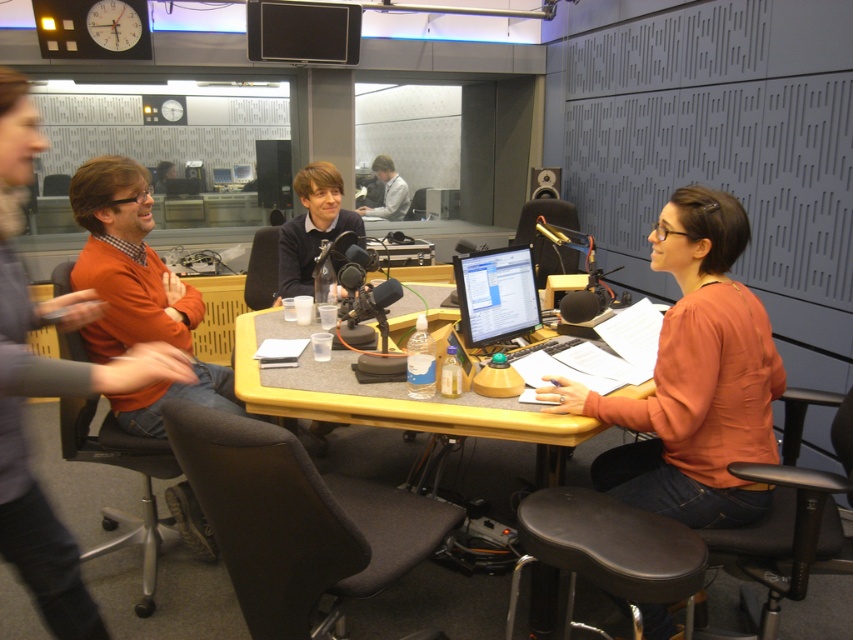
You are a sound engineer in the studio and need to adjust the microphone stand that is positioned near the yellow matte table at center. To avoid blocking the view of the orange fabric shirt at center, should you move the microphone stand closer to or farther from the table?

The orange fabric shirt at center is located above the yellow matte table at center, so moving the microphone stand closer to the table would place it directly underneath the shirt, potentially blocking its view. To avoid obstruction, move the microphone stand farther from the table.

You are a sound engineer in the radio studio and need to place a microphone stand at the exact center of the room. The black leather stool at lower center is at coordinates point 0.863, 0.714. Is the stool positioned to the left or right of the room center?

The black leather stool at lower center is located at point (608, 552). Since the coordinates are based on a scale from 0 to 1, where (426, 320) is the center, the stool is to the right and slightly below the room center because its x coordinate 0.863 is greater than 0.5 and y coordinate 0.714 is also greater than 0.5 but closer to the bottom half.

You are a sound technician in the studio and need to place a microphone stand that requires 1 meter of space. Given the orange fabric shirt at center and the yellow matte table at center, which object has a smaller width and can you fit the microphone stand between them?

The orange fabric shirt at center has a smaller width than the yellow matte table at center. Since the orange fabric shirt at center is narrower, the microphone stand requiring 1 meter of space may fit between them if the available space between the shirt and the table is at least 1 meter.